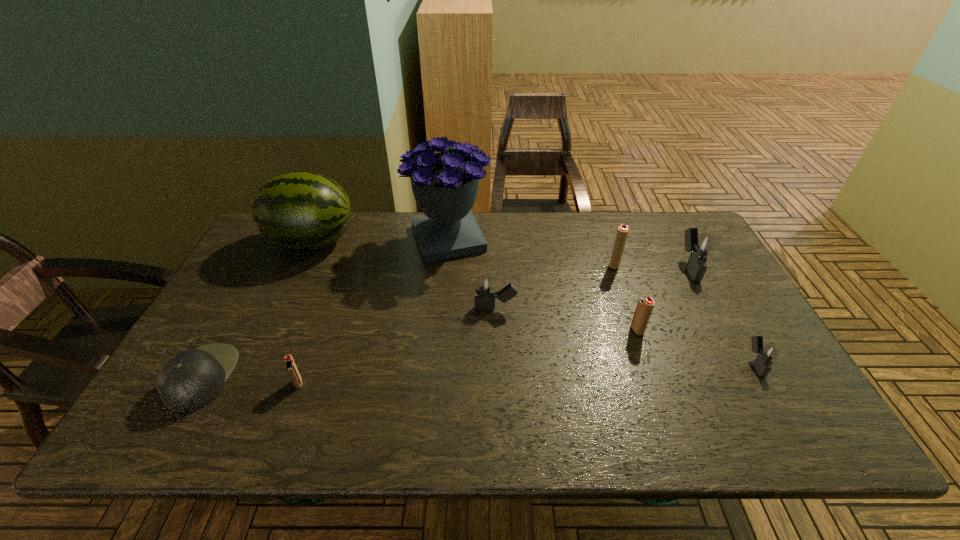
Identify the location of vacant area in the image that satisfies the following two spatial constraints: 1. at the stem end of the biggest red igniter; 2. on the right side of the green watermelon. (301, 265).

Where is `vacant space that satisfies the following two spatial constraints: 1. on the front side of the second biggest gray igniter; 2. on the right side of the second farthest red igniter`? vacant space that satisfies the following two spatial constraints: 1. on the front side of the second biggest gray igniter; 2. on the right side of the second farthest red igniter is located at coordinates (496, 330).